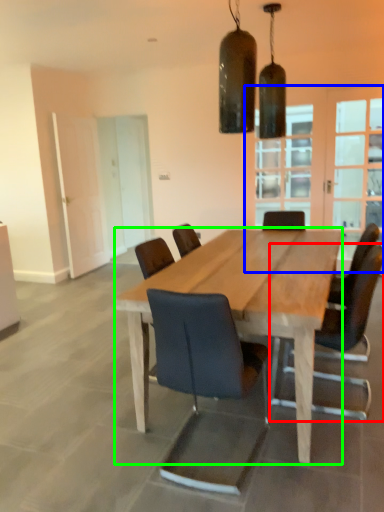
Question: Which is nearer to the chair (highlighted by a red box)? glass door (highlighted by a blue box) or kitchen & dining room table (highlighted by a green box).

Choices:
 (A) glass door
 (B) kitchen & dining room table

Answer: (B)